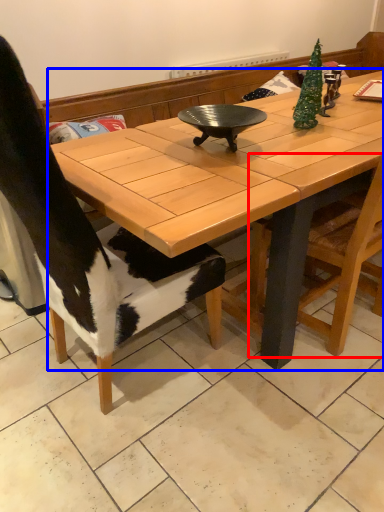
Question: Among these objects, which one is farthest to the camera, chair (highlighted by a red box) or coffee table (highlighted by a blue box)?

Choices:
 (A) chair
 (B) coffee table

Answer: (A)